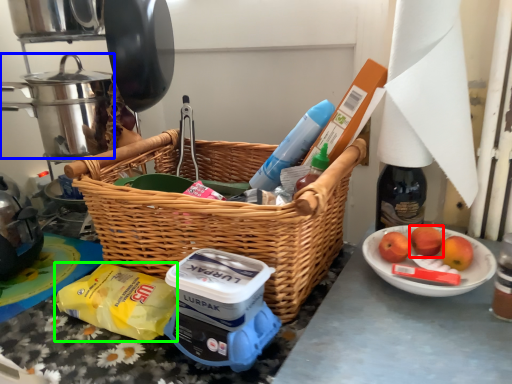
Question: Which is nearer to the apple (highlighted by a red box)? crock pot (highlighted by a blue box) or food (highlighted by a green box).

Choices:
 (A) crock pot
 (B) food

Answer: (B)